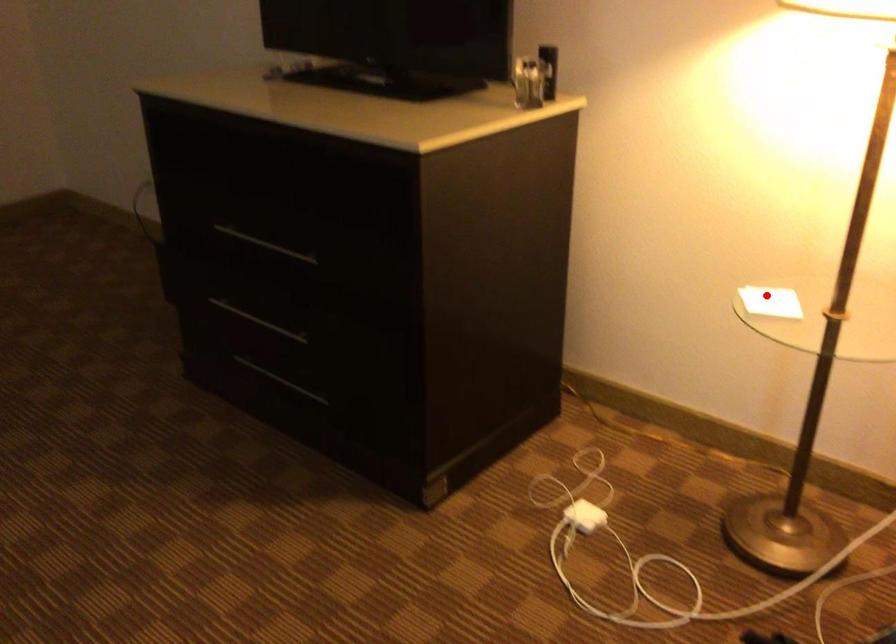
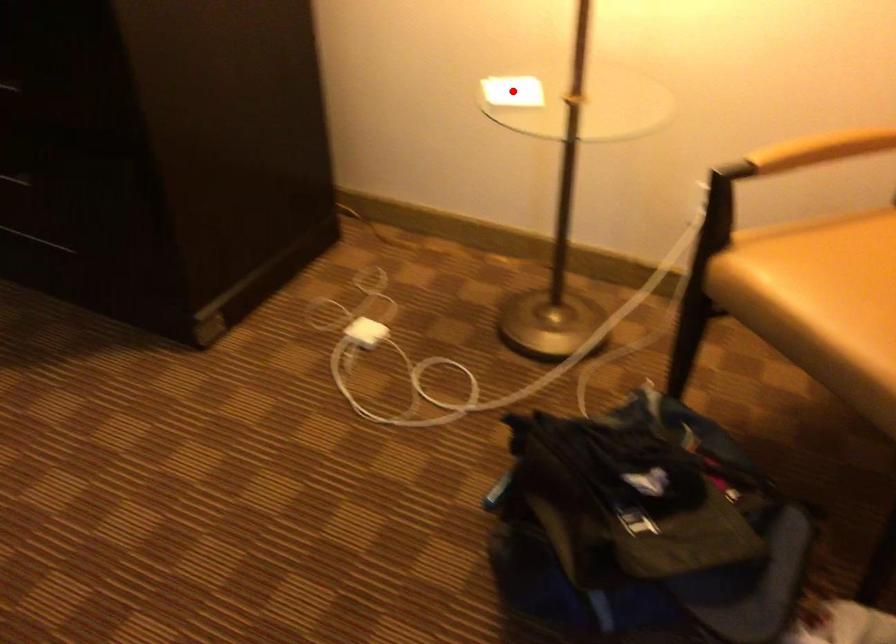
I am providing you with two images of the same scene from different viewpoints. A red point is marked on the first image and another point is marked on the second image. Does the point marked in image1 correspond to the same location as the one in image2?

Yes